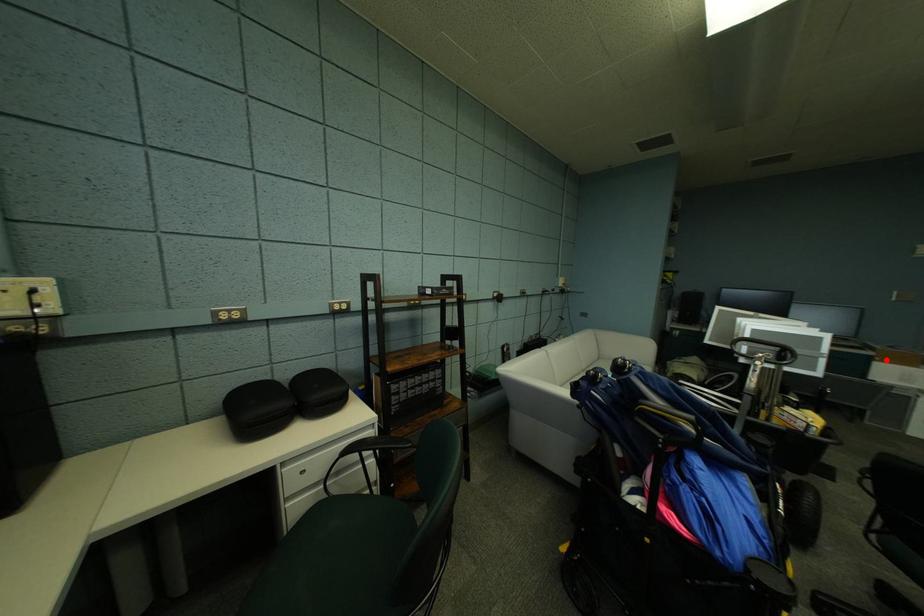
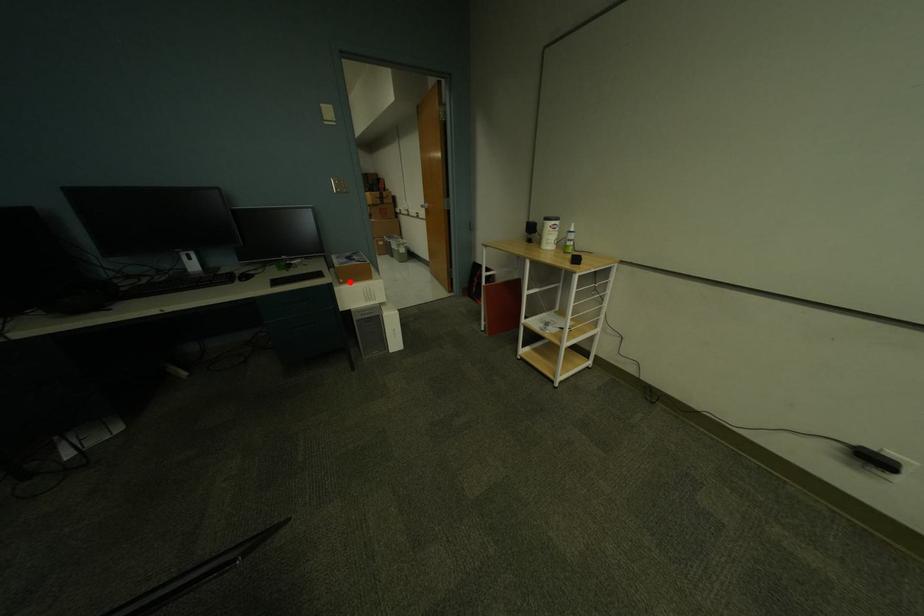
I am providing you with two images of the same scene from different viewpoints. A red point is marked on the first image and another point is marked on the second image. Does the point marked in image1 correspond to the same location as the one in image2?

Yes